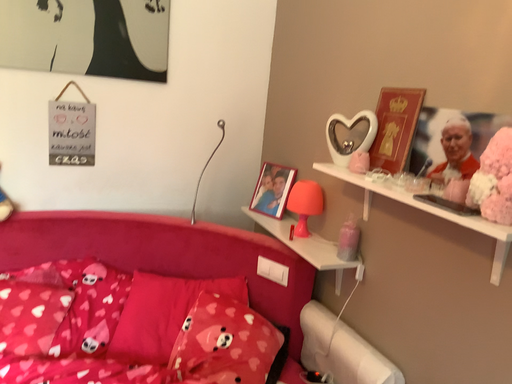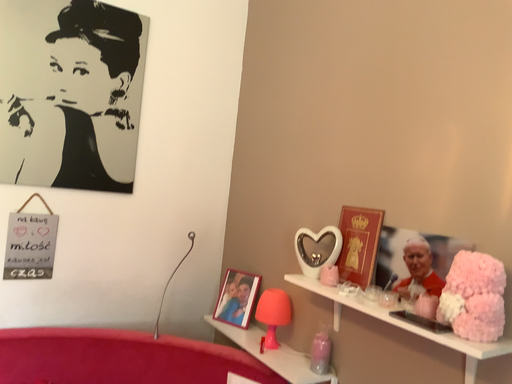
Question: Which way did the camera rotate in the video?

Choices:
 (A) rotated downward
 (B) rotated upward

Answer: (B)